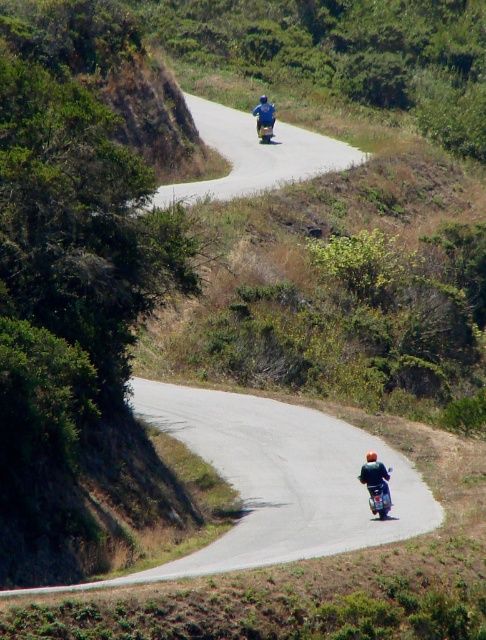
Who is more forward, (294, 440) or (270, 140)?

Point (294, 440)

Does smooth asphalt road at center have a lesser height compared to blue metallic motorcycle at upper center?

No, smooth asphalt road at center is not shorter than blue metallic motorcycle at upper center.

Is point (285, 460) positioned before point (270, 120)?

That is True.

Where is `smooth asphalt road at center`? This screenshot has width=486, height=640. smooth asphalt road at center is located at coordinates (277, 481).

Measure the distance between dark blue jacket at lower right and blue fabric shirt at upper center.

dark blue jacket at lower right and blue fabric shirt at upper center are 42.06 meters apart.

Does dark blue jacket at lower right have a greater width compared to blue fabric shirt at upper center?

Indeed, dark blue jacket at lower right has a greater width compared to blue fabric shirt at upper center.

Does point (385, 476) come farther from viewer compared to point (271, 108)?

That is False.

I want to click on dark blue jacket at lower right, so click(x=375, y=474).

Who is more distant from viewer, (372, 500) or (258, 132)?

The point (258, 132) is more distant.

In the scene shown: Is shiny metallic motorcycle at lower right to the right of blue metallic motorcycle at upper center from the viewer's perspective?

Indeed, shiny metallic motorcycle at lower right is positioned on the right side of blue metallic motorcycle at upper center.

Does point (381, 506) come closer to viewer compared to point (266, 120)?

That is True.

Where is `shiny metallic motorcycle at lower right`? The image size is (486, 640). shiny metallic motorcycle at lower right is located at coordinates click(377, 486).